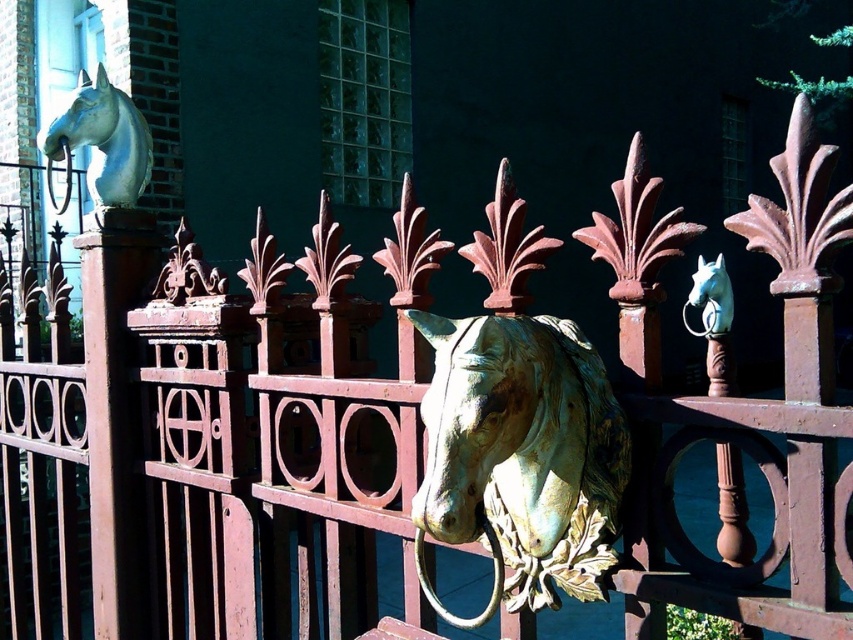
Question: Which point is farther to the camera?

Choices:
 (A) shiny white horse head at upper left
 (B) matte green horse head at upper left
 (C) gold patina metal horse head at center

Answer: (B)

Question: Does gold patina metal horse head at center lie behind shiny white horse head at upper left?

Choices:
 (A) yes
 (B) no

Answer: (B)

Question: Is gold patina metal horse head at center positioned in front of matte green horse head at upper left?

Choices:
 (A) no
 (B) yes

Answer: (B)

Question: Is gold patina metal horse head at center to the left of matte green horse head at upper left from the viewer's perspective?

Choices:
 (A) yes
 (B) no

Answer: (B)

Question: Which point is farther from the camera taking this photo?

Choices:
 (A) (419, 556)
 (B) (711, 300)
 (C) (138, 168)

Answer: (C)

Question: Which is nearer to the gold patina metal horse head at center?

Choices:
 (A) shiny white horse head at upper left
 (B) matte green horse head at upper left

Answer: (A)